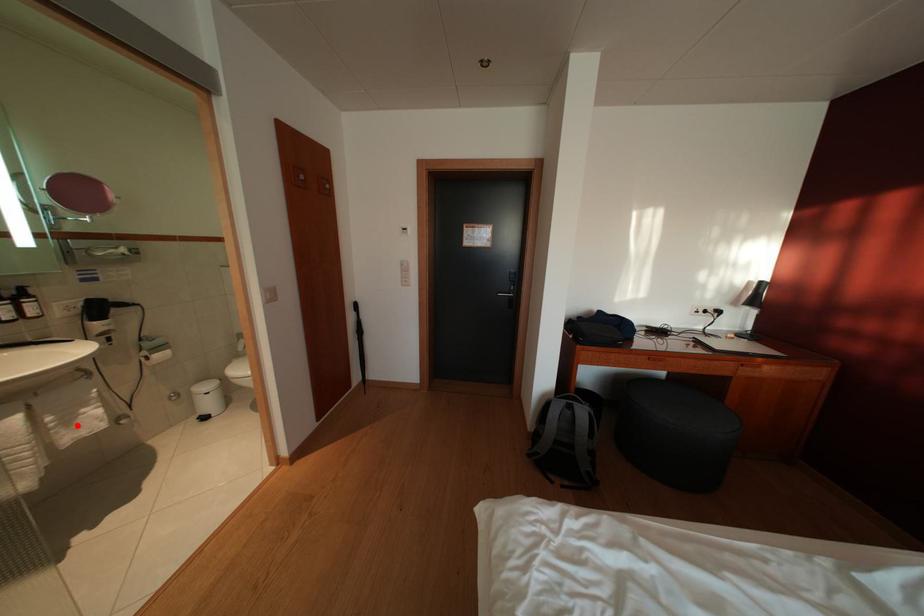
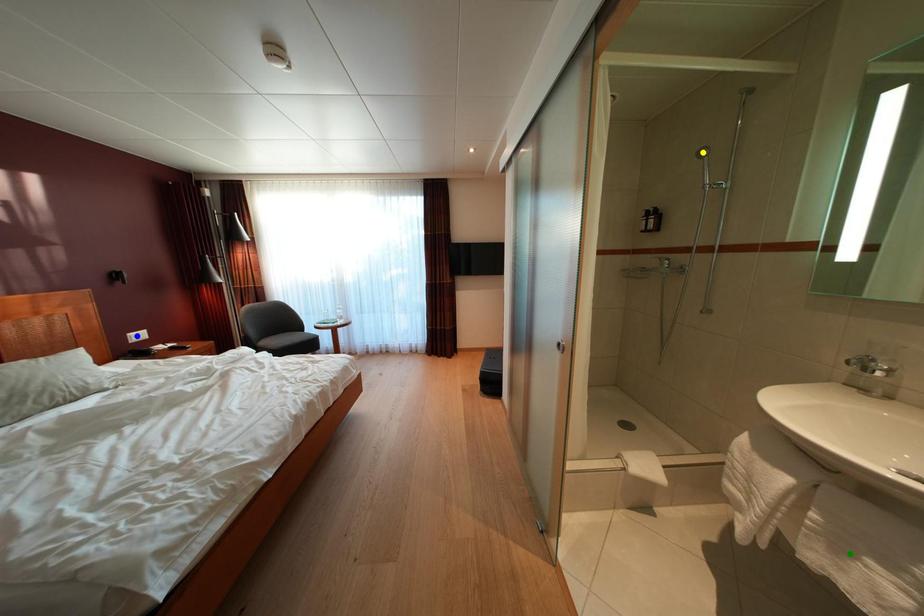
Question: I am providing you with two images of the same scene from different viewpoints. A red point is marked on the first image. You are given multiple points on the second image. Which mark in image 2 goes with the point in image 1?

Choices:
 (A) green point
 (B) yellow point
 (C) blue point

Answer: (A)